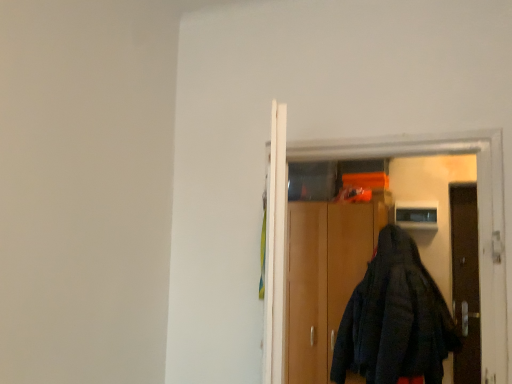
Describe the element at coordinates (323, 279) in the screenshot. I see `wooden cabinet at center` at that location.

What is the approximate width of wooden cabinet at center?

21.27 inches.

I want to click on wooden cabinet at center, so click(323, 279).

What do you see at coordinates (478, 207) in the screenshot?
I see `black fabric coat at center` at bounding box center [478, 207].

I want to click on black fabric coat at center, so click(x=478, y=207).

What is the approximate height of black fabric coat at center?

black fabric coat at center is 3.67 feet tall.

Locate an element on the screen. This screenshot has width=512, height=384. wooden cabinet at center is located at coordinates (323, 279).

Can you confirm if black fabric coat at center is positioned to the right of wooden cabinet at center?

In fact, black fabric coat at center is to the left of wooden cabinet at center.

Does black fabric coat at center come in front of wooden cabinet at center?

Yes, it is in front of wooden cabinet at center.

Which is closer, [506,359] or [349,257]?

Point [506,359] is positioned closer to the camera compared to point [349,257].

From the image's perspective, is black fabric coat at center over wooden cabinet at center?

Yes, from the image's perspective, black fabric coat at center is on top of wooden cabinet at center.

From a real-world perspective, between black fabric coat at center and wooden cabinet at center, who is vertically lower?

wooden cabinet at center is physically lower.

Is black fabric coat at center wider than wooden cabinet at center?

No, black fabric coat at center is not wider than wooden cabinet at center.

Can you confirm if black fabric coat at center is shorter than wooden cabinet at center?

Yes, black fabric coat at center is shorter than wooden cabinet at center.

Considering the relative sizes of black fabric coat at center and wooden cabinet at center in the image provided, is black fabric coat at center smaller than wooden cabinet at center?

Correct, black fabric coat at center occupies less space than wooden cabinet at center.

Is wooden cabinet at center inside black fabric coat at center?

No, wooden cabinet at center is not inside black fabric coat at center.

Consider the image. Are black fabric coat at center and wooden cabinet at center making contact?

They are not placed beside each other.

Is black fabric coat at center facing towards wooden cabinet at center?

No, black fabric coat at center is not oriented towards wooden cabinet at center.

I want to click on elevator in front of the wooden cabinet at center, so click(x=478, y=207).

Which object is positioned more to the left, wooden cabinet at center or black fabric coat at center?

black fabric coat at center.

In the scene shown: Does wooden cabinet at center lie behind black fabric coat at center?

Yes, wooden cabinet at center is further from the viewer.

Is point (331, 360) positioned behind point (275, 290)?

Yes, it is behind point (275, 290).

From the image's perspective, is wooden cabinet at center over black fabric coat at center?

No, from the image's perspective, wooden cabinet at center is not over black fabric coat at center.

Based on the photo, from a real-world perspective, relative to black fabric coat at center, is wooden cabinet at center vertically above or below?

wooden cabinet at center is situated lower than black fabric coat at center in the real world.

In terms of width, does wooden cabinet at center look wider or thinner when compared to black fabric coat at center?

wooden cabinet at center is wider than black fabric coat at center.

Is wooden cabinet at center shorter than black fabric coat at center?

In fact, wooden cabinet at center may be taller than black fabric coat at center.

Considering the relative sizes of wooden cabinet at center and black fabric coat at center in the image provided, is wooden cabinet at center smaller than black fabric coat at center?

No, wooden cabinet at center is not smaller than black fabric coat at center.

Which is correct: wooden cabinet at center is inside black fabric coat at center, or outside of it?

wooden cabinet at center exists outside the volume of black fabric coat at center.

Is wooden cabinet at center far from black fabric coat at center?

That's right, there is a large distance between wooden cabinet at center and black fabric coat at center.

Is wooden cabinet at center oriented away from black fabric coat at center?

wooden cabinet at center does not have its back to black fabric coat at center.

Can you tell me how much wooden cabinet at center and black fabric coat at center differ in facing direction?

They differ by 1.31 degrees in their facing directions.

From the picture: How much distance is there between wooden cabinet at center and black fabric coat at center?

wooden cabinet at center is 3.89 feet from black fabric coat at center.

This screenshot has height=384, width=512. What are the coordinates of `elevator above the wooden cabinet at center (from a real-world perspective)` in the screenshot? It's located at (478, 207).

The width and height of the screenshot is (512, 384). I want to click on cabinetry below the black fabric coat at center (from the image's perspective), so click(323, 279).

Where is `elevator above the wooden cabinet at center (from a real-world perspective)`? This screenshot has height=384, width=512. elevator above the wooden cabinet at center (from a real-world perspective) is located at coordinates (478, 207).